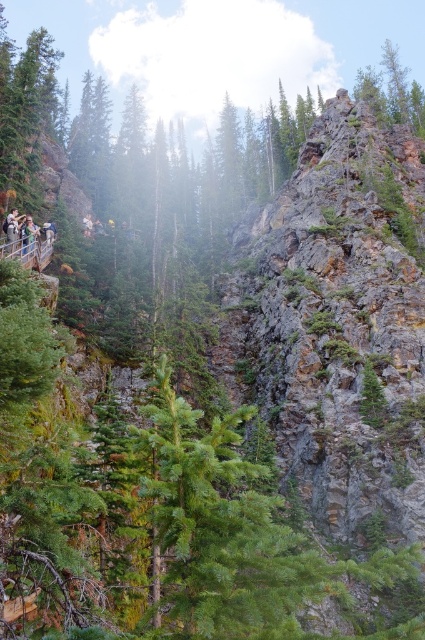
Question: Does matte black backpack at left have a smaller size compared to light brown wooden signpost at left?

Choices:
 (A) no
 (B) yes

Answer: (A)

Question: Considering the real-world distances, which object is farthest from the matte black backpack at left?

Choices:
 (A) light brown wooden signpost at left
 (B) light brown wooden railing at left

Answer: (A)

Question: Which point is farther from the camera taking this photo?

Choices:
 (A) (27, 220)
 (B) (5, 218)
 (C) (30, 241)

Answer: (A)

Question: Among these objects, which one is nearest to the camera?

Choices:
 (A) light brown wooden signpost at left
 (B) light brown wooden railing at left
 (C) matte black backpack at left

Answer: (C)

Question: Is matte black backpack at left positioned in front of light brown wooden railing at left?

Choices:
 (A) yes
 (B) no

Answer: (A)

Question: Does matte black backpack at left have a greater width compared to light brown wooden railing at left?

Choices:
 (A) yes
 (B) no

Answer: (A)